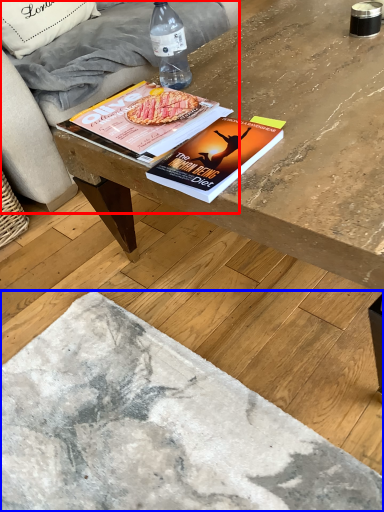
Question: Which object is further to the camera taking this photo, studio couch (highlighted by a red box) or concrete (highlighted by a blue box)?

Choices:
 (A) studio couch
 (B) concrete

Answer: (A)